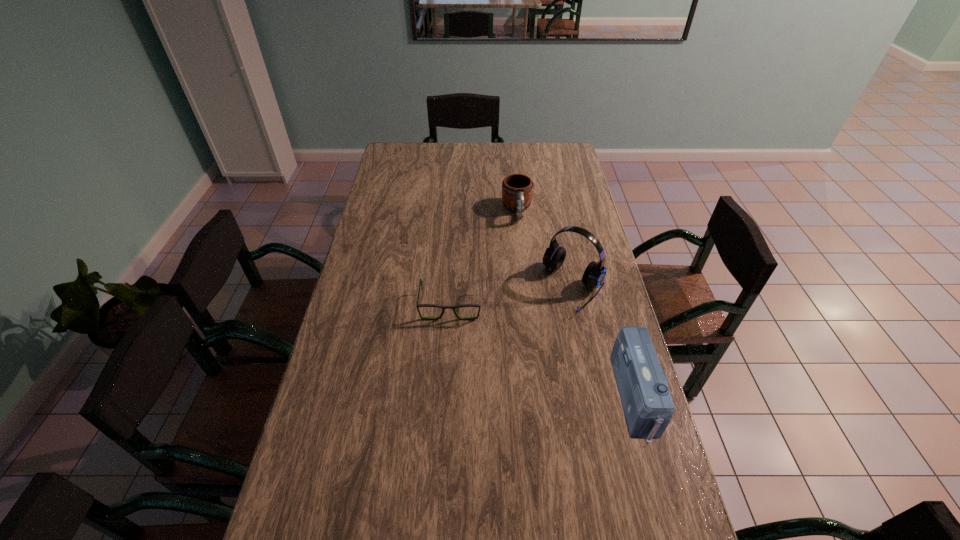
Locate an element on the screen. This screenshot has width=960, height=540. empty space between the farthest object and the second tallest object is located at coordinates (577, 304).

You are a GUI agent. You are given a task and a screenshot of the screen. Output one action in this format:
    pyautogui.click(x=<x>, y=<y>)
    Task: Click on the free space between the camera and the leftmost object
    
    Given the screenshot: What is the action you would take?
    (543, 351)

The height and width of the screenshot is (540, 960). I want to click on object that stands as the second closest to the nearest object, so click(420, 284).

Locate an element on the screen. Image resolution: width=960 pixels, height=540 pixels. object that is the third closest to the camera is located at coordinates (517, 189).

Find the location of a particular element. free location that satisfies the following two spatial constraints: 1. on the lens of the leftmost object; 2. on the lens of the camera is located at coordinates (444, 397).

Image resolution: width=960 pixels, height=540 pixels. What are the coordinates of `blank space that satisfies the following two spatial constraints: 1. on the front side of the nearest object; 2. on the lens of the tallest object` in the screenshot? It's located at (597, 397).

Identify the location of free location that satisfies the following two spatial constraints: 1. on the front side of the mug; 2. on the lens of the camera. (536, 397).

You are a GUI agent. You are given a task and a screenshot of the screen. Output one action in this format:
    pyautogui.click(x=<x>, y=<y>)
    Task: Click on the free point that satisfies the following two spatial constraints: 1. on the front side of the mug; 2. on the lens of the third shortest object
    
    Given the screenshot: What is the action you would take?
    pyautogui.click(x=536, y=397)

Where is `free space that satisfies the following two spatial constraints: 1. on the lens of the camera; 2. on the lens of the spectacles`? This screenshot has width=960, height=540. free space that satisfies the following two spatial constraints: 1. on the lens of the camera; 2. on the lens of the spectacles is located at coordinates (444, 397).